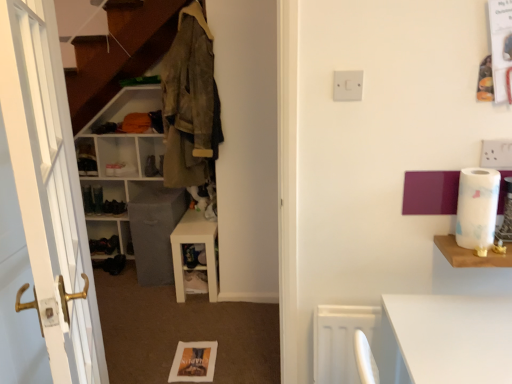
The image size is (512, 384). Describe the element at coordinates (123, 145) in the screenshot. I see `white matte shelf at center, the 3th shelf from the front` at that location.

Image resolution: width=512 pixels, height=384 pixels. In order to click on camouflage fabric jacket at upper left in this screenshot , I will do `click(190, 102)`.

What is the approximate width of white marble toilet paper at right?

It is 5.16 inches.

What is the approximate width of white glossy shelf at center, the second shelf when ordered from front to back?

12.09 inches.

Measure the distance between wooden shelf at right, which appears as the 1th shelf when viewed from the right, and camera.

wooden shelf at right, which appears as the 1th shelf when viewed from the right, and camera are 3.99 feet apart.

In order to face wooden shelf at right, the third shelf positioned from the left, should I rotate leftwards or rightwards?

Rotate right and turn 31.067 degrees.

What are the coordinates of `white glossy dresser at center` in the screenshot? It's located at (246, 149).

Identify the location of white wooden door at left. The width and height of the screenshot is (512, 384). (49, 188).

This screenshot has height=384, width=512. I want to click on white matte shelf at center, marked as the third shelf in a right-to-left arrangement, so click(123, 145).

Would you say white matte shelf at center, the 3th shelf from the front, contains white plastic switch at upper center?

No, white plastic switch at upper center is not inside white matte shelf at center, the 3th shelf from the front.

Is the depth of white matte shelf at center, marked as the third shelf in a right-to-left arrangement, greater than that of white plastic switch at upper center?

Yes, white matte shelf at center, marked as the third shelf in a right-to-left arrangement, is behind white plastic switch at upper center.

Does white matte shelf at center, which ranks as the first shelf in back-to-front order, appear on the right side of white plastic switch at upper center?

In fact, white matte shelf at center, which ranks as the first shelf in back-to-front order, is to the left of white plastic switch at upper center.

Does white matte shelf at center, marked as the third shelf in a right-to-left arrangement, turn towards white plastic switch at upper center?

No, white matte shelf at center, marked as the third shelf in a right-to-left arrangement, is not oriented towards white plastic switch at upper center.

Is white plastic switch at upper center oriented towards black leather shoe at lower left?

No, white plastic switch at upper center is not aimed at black leather shoe at lower left.

Which object is thinner, white plastic switch at upper center or black leather shoe at lower left?

With smaller width is white plastic switch at upper center.

Is white plastic switch at upper center outside of black leather shoe at lower left?

That's correct, white plastic switch at upper center is outside of black leather shoe at lower left.

From the image's perspective, between white plastic switch at upper center and black leather shoe at lower left, who is located below?

black leather shoe at lower left is shown below in the image.

Considering the relative sizes of white glossy dresser at center and white glossy shelf at center, the second shelf when ordered from front to back, in the image provided, is white glossy dresser at center shorter than white glossy shelf at center, the second shelf when ordered from front to back,?

Incorrect, the height of white glossy dresser at center does not fall short of that of white glossy shelf at center, the second shelf when ordered from front to back.

Which is behind, point (233, 254) or point (178, 302)?

The point (178, 302) is farther from the camera.

Find the location of `dresser in front of the white glossy shelf at center, marked as the second shelf in a left-to-right arrangement`. dresser in front of the white glossy shelf at center, marked as the second shelf in a left-to-right arrangement is located at coordinates (246, 149).

Based on the photo, could you tell me if white glossy dresser at center is facing white glossy shelf at center, which is the second shelf in right-to-left order?

No, white glossy dresser at center is not turned towards white glossy shelf at center, which is the second shelf in right-to-left order.

Is point (227, 119) positioned before point (187, 59)?

No, it is behind (187, 59).

Is white glossy dresser at center bigger or smaller than camouflage fabric jacket at upper left?

Considering their sizes, white glossy dresser at center takes up more space than camouflage fabric jacket at upper left.

Can you see white glossy dresser at center touching camouflage fabric jacket at upper left?

white glossy dresser at center is not next to camouflage fabric jacket at upper left, and they're not touching.

Does white glossy dresser at center appear on the left side of camouflage fabric jacket at upper left?

In fact, white glossy dresser at center is to the right of camouflage fabric jacket at upper left.

Between point (188, 128) and point (124, 101), which one is positioned behind?

The point (124, 101) is farther from the camera.

Is camouflage fabric jacket at upper left at the right side of white matte shelf at center, which ranks as the first shelf in back-to-front order?

Indeed, camouflage fabric jacket at upper left is positioned on the right side of white matte shelf at center, which ranks as the first shelf in back-to-front order.

From a real-world perspective, count 2nd shelfs downward from the camouflage fabric jacket at upper left and point to it. Please provide its 2D coordinates.

[(123, 145)]

Which object is further away from the camera taking this photo, camouflage fabric jacket at upper left or white matte shelf at center, which ranks as the first shelf in back-to-front order?

white matte shelf at center, which ranks as the first shelf in back-to-front order, is further away from the camera.

From a real-world perspective, is wooden shelf at right, which appears as the 1th shelf when viewed from the right, over camouflage fabric jacket at upper left?

Actually, wooden shelf at right, which appears as the 1th shelf when viewed from the right, is physically below camouflage fabric jacket at upper left in the real world.

Is camouflage fabric jacket at upper left a part of wooden shelf at right, which appears as the 1th shelf when viewed from the right?

No, camouflage fabric jacket at upper left is not inside wooden shelf at right, which appears as the 1th shelf when viewed from the right.

Can you tell me how much wooden shelf at right, which appears as the 1th shelf when viewed from the right, and camouflage fabric jacket at upper left differ in facing direction?

The angular difference between wooden shelf at right, which appears as the 1th shelf when viewed from the right, and camouflage fabric jacket at upper left is 0.118 degrees.

Is wooden shelf at right, acting as the third shelf starting from the back, taller or shorter than camouflage fabric jacket at upper left?

Considering their sizes, wooden shelf at right, acting as the third shelf starting from the back, has less height than camouflage fabric jacket at upper left.

Between white matte shelf at center, which ranks as the first shelf in back-to-front order, and camouflage fabric jacket at upper left, which one has less height?

Answer: camouflage fabric jacket at upper left is shorter.

Is white matte shelf at center, positioned as the 1th shelf in left-to-right order, wider or thinner than camouflage fabric jacket at upper left?

Considering their sizes, white matte shelf at center, positioned as the 1th shelf in left-to-right order, looks broader than camouflage fabric jacket at upper left.

Where is `shelf that is the 2nd one below the camouflage fabric jacket at upper left (from a real-world perspective)`? The height and width of the screenshot is (384, 512). shelf that is the 2nd one below the camouflage fabric jacket at upper left (from a real-world perspective) is located at coordinates (123, 145).

Could camouflage fabric jacket at upper left be considered to be inside white matte shelf at center, positioned as the 1th shelf in left-to-right order?

Actually, camouflage fabric jacket at upper left is outside white matte shelf at center, positioned as the 1th shelf in left-to-right order.

Identify the location of the 2nd shelf behind the white plastic switch at upper center. This screenshot has height=384, width=512. point(123,145).

Where is `electric outlet that appears above the black leather shoe at lower left (from a real-world perspective)`? The height and width of the screenshot is (384, 512). electric outlet that appears above the black leather shoe at lower left (from a real-world perspective) is located at coordinates (348, 85).

Estimate the real-world distances between objects in this image. Which object is closer to white glossy dresser at center, camouflage fabric jacket at upper left or wooden shelf at right, placed as the 1th shelf when sorted from front to back?

The object closer to white glossy dresser at center is camouflage fabric jacket at upper left.

Considering their positions, is matte white cabinet at left positioned closer to white plastic switch at upper center than wooden shelf at right, which appears as the 1th shelf when viewed from the right?

wooden shelf at right, which appears as the 1th shelf when viewed from the right, is positioned closer to the anchor white plastic switch at upper center.

Based on their spatial positions, is black leather shoe at lower left or matte white cabinet at left closer to white glossy shelf at center, marked as the second shelf in a left-to-right arrangement?

Among the two, black leather shoe at lower left is located nearer to white glossy shelf at center, marked as the second shelf in a left-to-right arrangement.

From the image, which object appears to be farther from white plastic switch at upper center, white glossy shelf at center, which is the second shelf in right-to-left order, or camouflage fabric jacket at upper left?

white glossy shelf at center, which is the second shelf in right-to-left order.

Considering their positions, is camouflage fabric jacket at upper left positioned closer to white wooden door at left than white glossy shelf at center, the second shelf when ordered from front to back?

camouflage fabric jacket at upper left.

From the image, which object appears to be farther from camouflage fabric jacket at upper left, white glossy dresser at center or matte white cabinet at left?

Based on the image, matte white cabinet at left appears to be further to camouflage fabric jacket at upper left.

From the image, which object appears to be nearer to white wooden door at left, wooden shelf at right, acting as the third shelf starting from the back, or white plastic switch at upper center?

white plastic switch at upper center is closer to white wooden door at left.

Which object lies nearer to the anchor point white marble toilet paper at right, white matte shelf at center, the 3th shelf from the front, or matte white cabinet at left?

white matte shelf at center, the 3th shelf from the front.

You are a GUI agent. You are given a task and a screenshot of the screen. Output one action in this format:
    pyautogui.click(x=<x>, y=<y>)
    Task: Click on the dresser located between camouflage fabric jacket at upper left and wooden shelf at right, placed as the 1th shelf when sorted from front to back, in the left-right direction
    The height and width of the screenshot is (384, 512).
    Given the screenshot: What is the action you would take?
    pyautogui.click(x=246, y=149)

Where is `electric outlet between wooden shelf at right, acting as the third shelf starting from the back, and matte white cabinet at left from front to back`? electric outlet between wooden shelf at right, acting as the third shelf starting from the back, and matte white cabinet at left from front to back is located at coordinates (348, 85).

Locate an element on the screen. toilet paper located between white wooden door at left and matte white cabinet at left in the depth direction is located at coordinates (477, 207).

You are a GUI agent. You are given a task and a screenshot of the screen. Output one action in this format:
    pyautogui.click(x=<x>, y=<y>)
    Task: Click on the dresser located between wooden shelf at right, placed as the 1th shelf when sorted from front to back, and white glossy shelf at center, which is the second shelf in right-to-left order, in the depth direction
    The width and height of the screenshot is (512, 384).
    Given the screenshot: What is the action you would take?
    pyautogui.click(x=246, y=149)